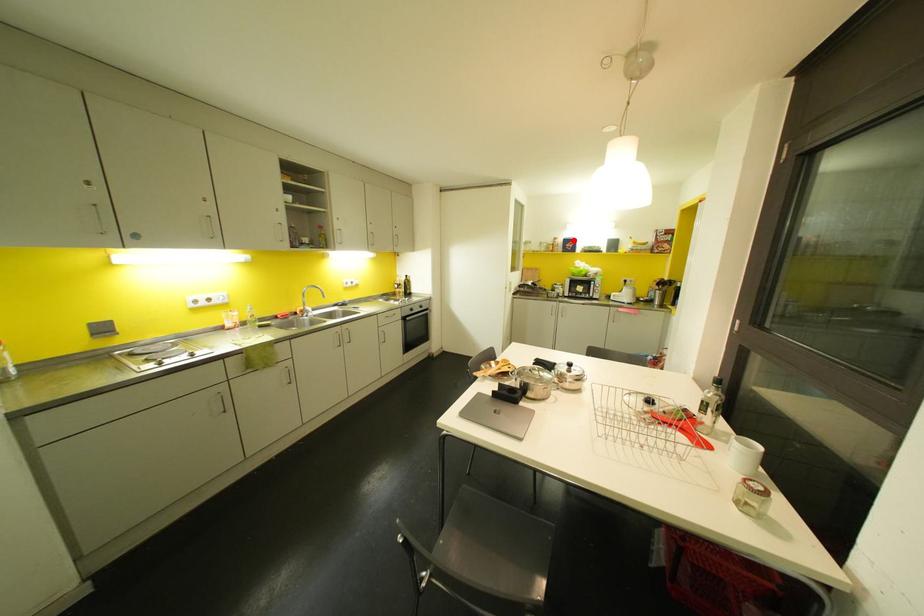
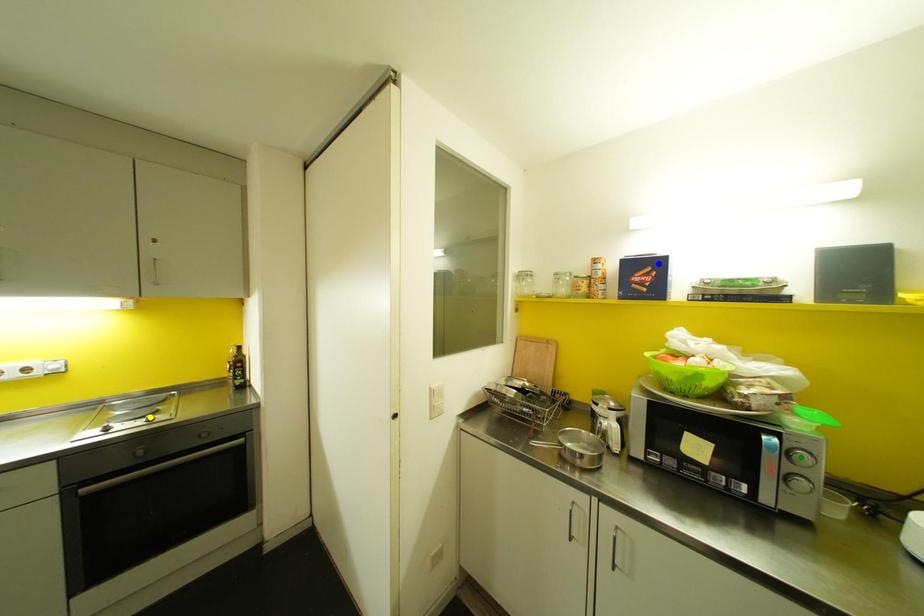
Question: I am providing you with two images of the same scene from different viewpoints. A red point is marked on the first image. You are given multiple points on the second image. Which spot in image 2 lines up with the point in image 1?

Choices:
 (A) green point
 (B) yellow point
 (C) blue point

Answer: (C)